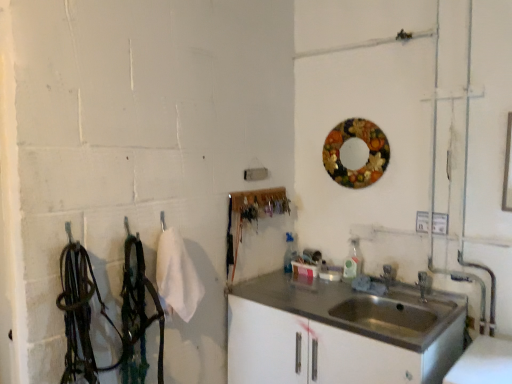
Question: Is satin white cabinet at lower right oriented away from satin silver faucet at sink right?

Choices:
 (A) yes
 (B) no

Answer: (B)

Question: Does satin white cabinet at lower right contain satin silver faucet at sink right?

Choices:
 (A) yes
 (B) no

Answer: (B)

Question: Is satin white cabinet at lower right to the right of satin silver faucet at sink right from the viewer's perspective?

Choices:
 (A) yes
 (B) no

Answer: (B)

Question: Considering the relative positions of satin white cabinet at lower right and satin silver faucet at sink right in the image provided, is satin white cabinet at lower right behind satin silver faucet at sink right?

Choices:
 (A) yes
 (B) no

Answer: (B)

Question: Are satin white cabinet at lower right and satin silver faucet at sink right far apart?

Choices:
 (A) yes
 (B) no

Answer: (B)

Question: Is satin silver faucet at sink right to the left or to the right of wooden circular mirror at upper right in the image?

Choices:
 (A) left
 (B) right

Answer: (B)

Question: From a real-world perspective, is satin silver faucet at sink right above or below wooden circular mirror at upper right?

Choices:
 (A) below
 (B) above

Answer: (A)

Question: Is satin silver faucet at sink right in front of or behind wooden circular mirror at upper right in the image?

Choices:
 (A) front
 (B) behind

Answer: (B)

Question: Is satin silver faucet at sink right inside or outside of wooden circular mirror at upper right?

Choices:
 (A) inside
 (B) outside

Answer: (B)

Question: Considering the positions of wooden circular mirror at upper right and satin silver faucet at sink right in the image, is wooden circular mirror at upper right taller or shorter than satin silver faucet at sink right?

Choices:
 (A) tall
 (B) short

Answer: (A)

Question: Based on their positions, is wooden circular mirror at upper right located to the left or right of satin silver faucet at sink right?

Choices:
 (A) left
 (B) right

Answer: (A)

Question: Considering the positions of wooden circular mirror at upper right and satin silver faucet at sink right in the image, is wooden circular mirror at upper right wider or thinner than satin silver faucet at sink right?

Choices:
 (A) wide
 (B) thin

Answer: (B)

Question: Which is correct: wooden circular mirror at upper right is inside satin silver faucet at sink right, or outside of it?

Choices:
 (A) inside
 (B) outside

Answer: (B)

Question: From the image's perspective, is wooden circular mirror at upper right above or below satin white cabinet at lower right?

Choices:
 (A) below
 (B) above

Answer: (B)

Question: Is wooden circular mirror at upper right wider or thinner than satin white cabinet at lower right?

Choices:
 (A) thin
 (B) wide

Answer: (A)